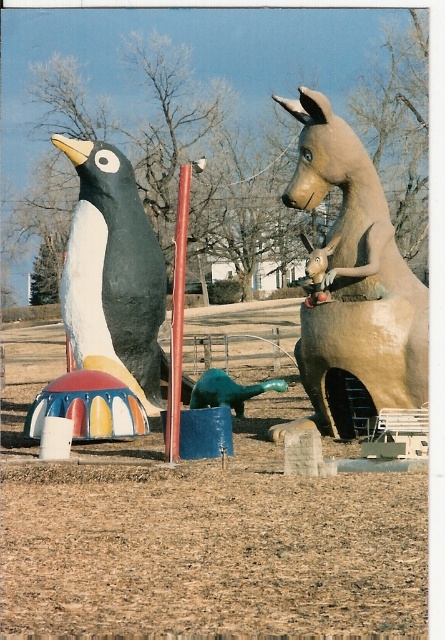
You are a visitor at the park and want to take a photo of the matte black penguin at left and the smooth red pole at center. To ensure both are in the frame, should you position yourself higher or lower than the current viewpoint?

The matte black penguin at left is located below the smooth red pole at center. To capture both in the frame, you should position yourself lower to ensure the penguin is visible above the ground and the pole remains in view.

You are a visitor in the park and want to take a photo of the matte clay horse at upper right and the matte black penguin at left. Which sculpture should you aim your camera at first if you want to capture both in the same frame without moving your camera?

The matte clay horse at upper right is located above the matte black penguin at left, so you should aim your camera at the matte clay horse at upper right first to ensure both are in the frame.